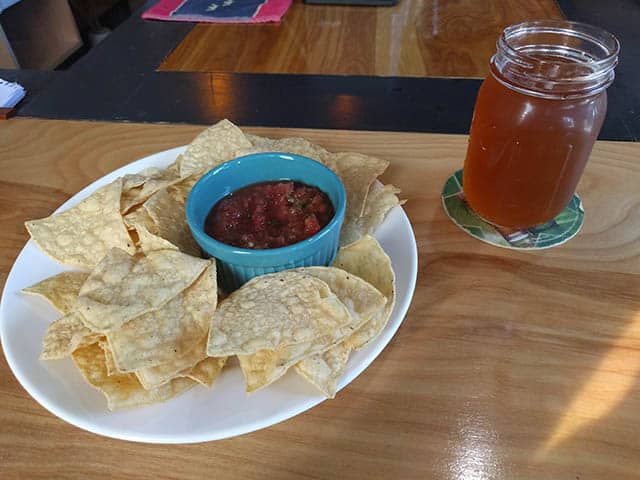
Find the location of a particular element. Image resolution: width=640 pixels, height=480 pixels. table is located at coordinates (443, 294), (413, 43).